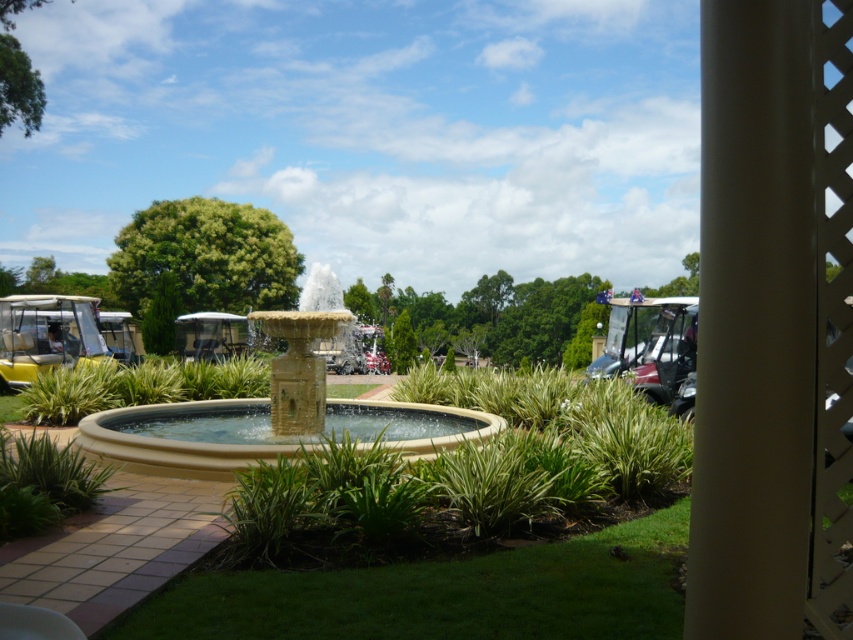
In the scene shown: Is yellow matte golf cart at left thinner than black plastic golf cart at right?

Incorrect, yellow matte golf cart at left's width is not less than black plastic golf cart at right's.

Does yellow matte golf cart at left have a lesser height compared to black plastic golf cart at right?

In fact, yellow matte golf cart at left may be taller than black plastic golf cart at right.

I want to click on yellow matte golf cart at left, so click(x=57, y=333).

Is point (265, 408) in front of point (675, 387)?

That is True.

Does beige stone fountain at center appear under black plastic golf cart at right?

Yes.

You are a GUI agent. You are given a task and a screenshot of the screen. Output one action in this format:
    pyautogui.click(x=<x>, y=<y>)
    Task: Click on the beige stone fountain at center
    Image resolution: width=853 pixels, height=640 pixels.
    Given the screenshot: What is the action you would take?
    pyautogui.click(x=268, y=428)

The width and height of the screenshot is (853, 640). I want to click on beige stone fountain at center, so click(x=268, y=428).

Is white textured pillar at center right below black plastic golf cart at right?

No, white textured pillar at center right is not below black plastic golf cart at right.

Is the position of white textured pillar at center right more distant than that of black plastic golf cart at right?

No, white textured pillar at center right is in front of black plastic golf cart at right.

Between point (701, 228) and point (618, 355), which one is positioned behind?

The point (618, 355) is more distant.

Locate an element on the screen. white textured pillar at center right is located at coordinates (753, 323).